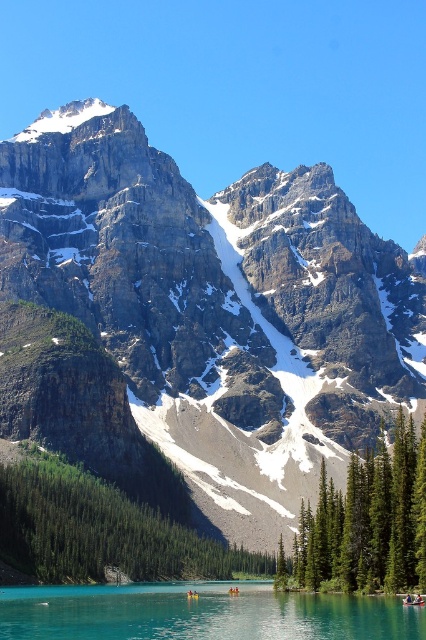
Question: Where is rocky gray mountain at center located in relation to green leafy trees at lower left in the image?

Choices:
 (A) below
 (B) above

Answer: (B)

Question: Which point is closer to the camera?

Choices:
 (A) (149, 573)
 (B) (391, 474)
 (C) (106, 264)

Answer: (B)

Question: Which is farther from the green textured tree at center?

Choices:
 (A) rocky gray mountain at center
 (B) green leafy trees at lower left

Answer: (A)

Question: Is rocky gray mountain at center closer to the viewer compared to green textured tree at center?

Choices:
 (A) yes
 (B) no

Answer: (B)

Question: Can you confirm if green leafy trees at lower left is positioned above green textured tree at center?

Choices:
 (A) yes
 (B) no

Answer: (B)

Question: Which of these objects is positioned closest to the turquoise glossy water at lower center?

Choices:
 (A) rocky gray mountain at center
 (B) green leafy trees at lower left

Answer: (B)